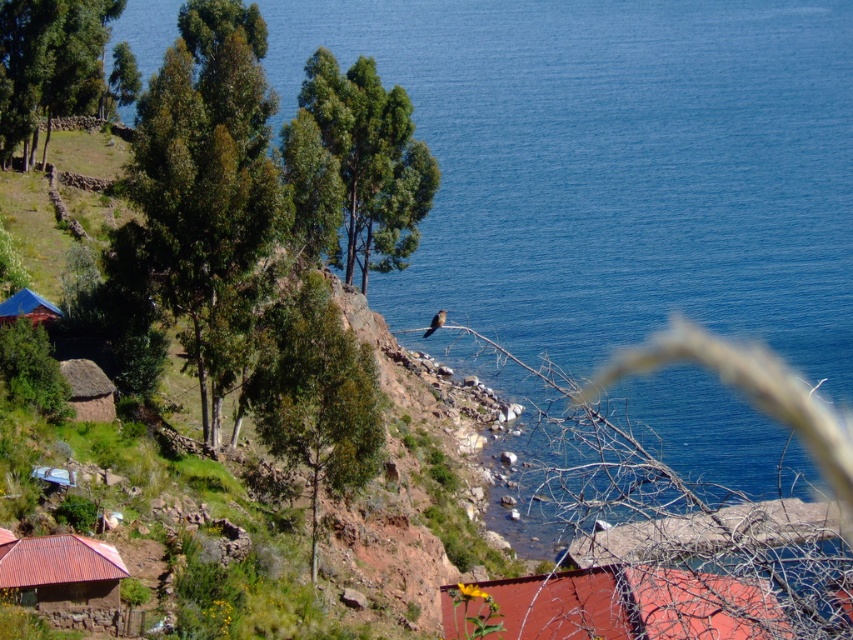
You are standing at the point marked by the coordinates point (202, 177) in the coastal landscape. Describe the immediate surroundings of this point based on the scene description.

The point (202, 177) is located on a green leafy tree at left, which is part of a sloping terrain covered with greenery and trees with dense foliage. The area has small structures with red and blue roofs and uneven ground with patches of grass and exposed earth.

You are standing at the point with coordinates 0.5, 0.5 in the image. You want to walk towards the blue water at center. In which direction should you go?

The blue water at center is located at coordinates (614, 168). Since you are at (426, 320), you should move towards the lower right direction to reach it.

You are standing at the center of the image and want to walk towards the blue tarpaulin hut at lower left. Will the green leafy tree at left block your direct path?

The green leafy tree at left is positioned over the blue tarpaulin hut at lower left, so it might block your direct path when walking towards the hut.